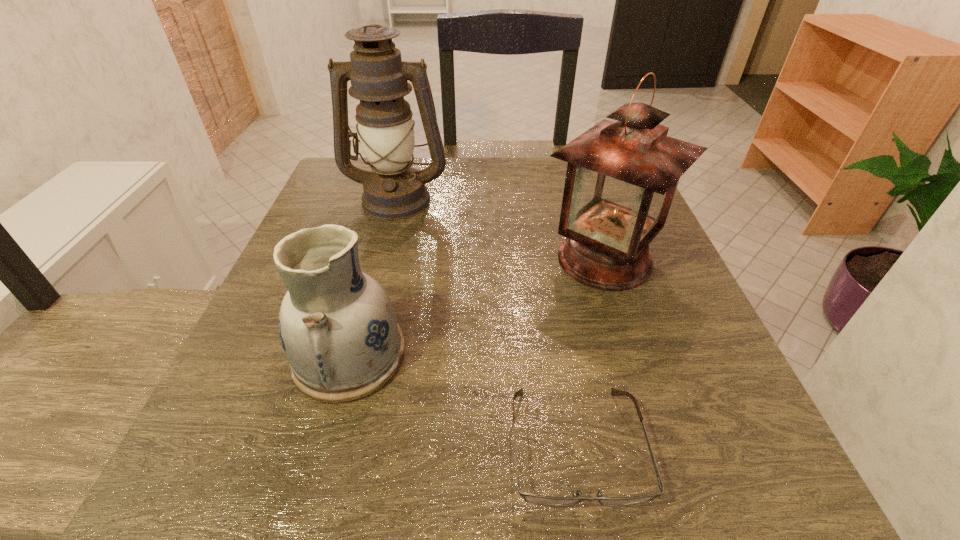
Locate an element on the screen. The image size is (960, 540). empty space between the left oil lamp and the spectacles is located at coordinates [487, 322].

Where is `blank region between the left oil lamp and the pottery`? The height and width of the screenshot is (540, 960). blank region between the left oil lamp and the pottery is located at coordinates (373, 277).

Locate an element on the screen. free space between the pottery and the nearer oil lamp is located at coordinates (477, 307).

Identify the location of free space between the pottery and the farthest object. The height and width of the screenshot is (540, 960). (373, 277).

This screenshot has height=540, width=960. I want to click on free space between the shortest object and the right oil lamp, so coord(590,352).

The image size is (960, 540). In order to click on vacant area that lies between the right oil lamp and the spectacles in this screenshot , I will do `click(590, 352)`.

At what (x,y) coordinates should I click in order to perform the action: click on unoccupied position between the second shortest object and the second farthest object. Please return your answer as a coordinate pair (x, y). This screenshot has height=540, width=960. Looking at the image, I should click on (477, 307).

Identify the location of vacant area between the farthest object and the spectacles. (487, 322).

Find the location of a particular element. The image size is (960, 540). vacant region between the farthest object and the right oil lamp is located at coordinates (501, 229).

What are the coordinates of `vacant space that is in between the shortest object and the right oil lamp` in the screenshot? It's located at (590, 352).